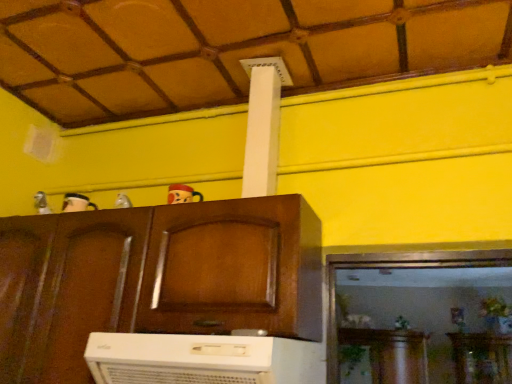
Question: From the image's perspective, is wooden ceiling at upper center located above or below metallic silver toy at upper center, which ranks as the second toy in right-to-left order?

Choices:
 (A) above
 (B) below

Answer: (A)

Question: Considering the positions of wooden ceiling at upper center and metallic silver toy at upper center, which ranks as the second toy in right-to-left order, in the image, is wooden ceiling at upper center wider or thinner than metallic silver toy at upper center, which ranks as the second toy in right-to-left order,?

Choices:
 (A) thin
 (B) wide

Answer: (B)

Question: Which object is the closest to the matte plastic toy at upper center, the first toy when ordered from right to left?

Choices:
 (A) wooden ceiling at upper center
 (B) metallic silver toy at upper center, which ranks as the second toy in right-to-left order
 (C) white plastic air conditioner at lower center
 (D) wooden cabinet at center

Answer: (B)

Question: Which of these objects is positioned farthest from the matte plastic toy at upper center, the first toy when ordered from right to left?

Choices:
 (A) wooden ceiling at upper center
 (B) white plastic air conditioner at lower center
 (C) metallic silver toy at upper center, which ranks as the second toy in right-to-left order
 (D) wooden cabinet at center

Answer: (B)